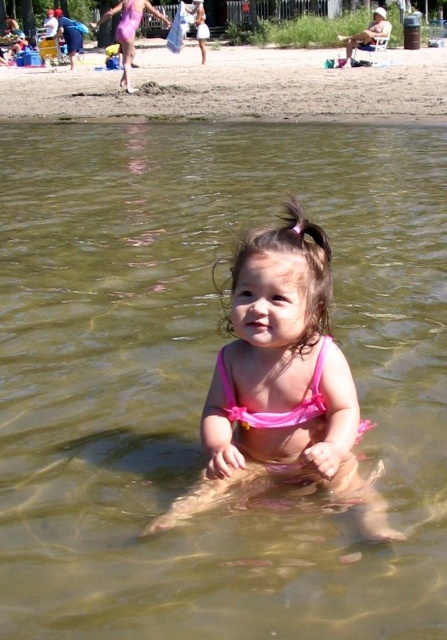
Question: Among these points, which one is farthest from the camera?

Choices:
 (A) (298, 419)
 (B) (146, 52)

Answer: (B)

Question: From the image, what is the correct spatial relationship of pink fabric bikini at center in relation to pink fabric swimsuit at center?

Choices:
 (A) right
 (B) left

Answer: (B)

Question: Is pink fabric bikini at center thinner than brown sand at upper center?

Choices:
 (A) yes
 (B) no

Answer: (A)

Question: Can you confirm if brown sand at upper center is bigger than pink fabric swimsuit at center?

Choices:
 (A) no
 (B) yes

Answer: (B)

Question: Which object appears closest to the camera in this image?

Choices:
 (A) brown sand at upper center
 (B) pink fabric swimsuit at center

Answer: (B)

Question: Among these points, which one is farthest from the camera?

Choices:
 (A) (3, 67)
 (B) (316, 385)

Answer: (A)